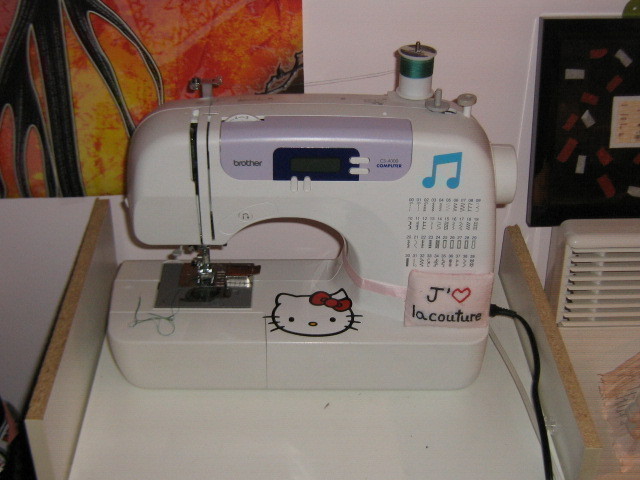
The height and width of the screenshot is (480, 640). I want to click on musical notes sticker, so click(x=438, y=158).